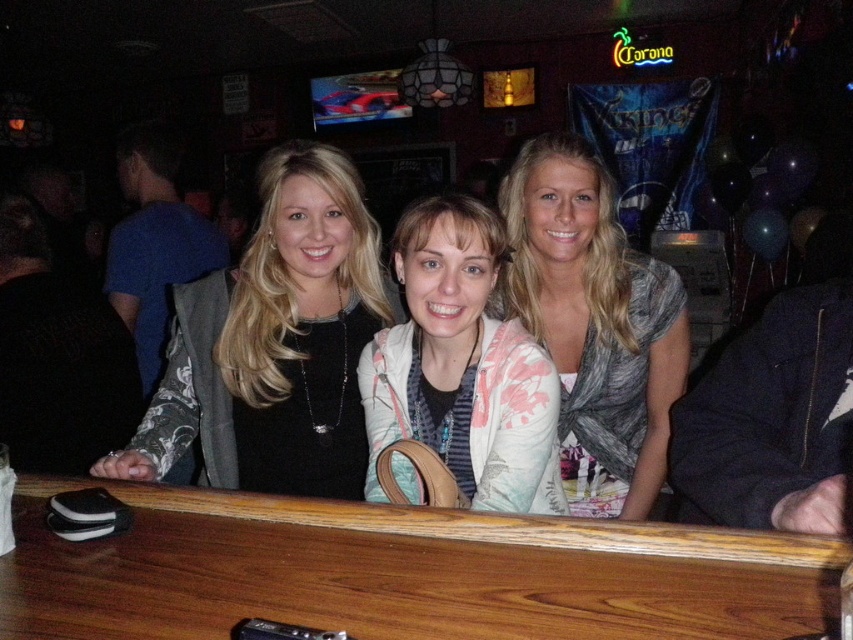
Does point (374, 596) come closer to viewer compared to point (282, 371)?

Yes.

Does point (483, 627) come behind point (283, 257)?

That is False.

Identify the location of wooden table at center. The height and width of the screenshot is (640, 853). pos(407,572).

Can you confirm if black matte vest at center is smaller than pink floral cardigan at center?

No.

Does black matte vest at center have a lesser height compared to pink floral cardigan at center?

In fact, black matte vest at center may be taller than pink floral cardigan at center.

Where is `black matte vest at center`? black matte vest at center is located at coordinates (276, 342).

Between black matte vest at center and gray textured scarf at center, which one has more height?

With more height is gray textured scarf at center.

Who is shorter, black matte vest at center or gray textured scarf at center?

With less height is black matte vest at center.

Which is in front, point (331, 435) or point (566, 248)?

Point (566, 248) is in front.

You are a GUI agent. You are given a task and a screenshot of the screen. Output one action in this format:
    pyautogui.click(x=<x>, y=<y>)
    Task: Click on the black matte vest at center
    Image resolution: width=853 pixels, height=640 pixels.
    Given the screenshot: What is the action you would take?
    pyautogui.click(x=276, y=342)